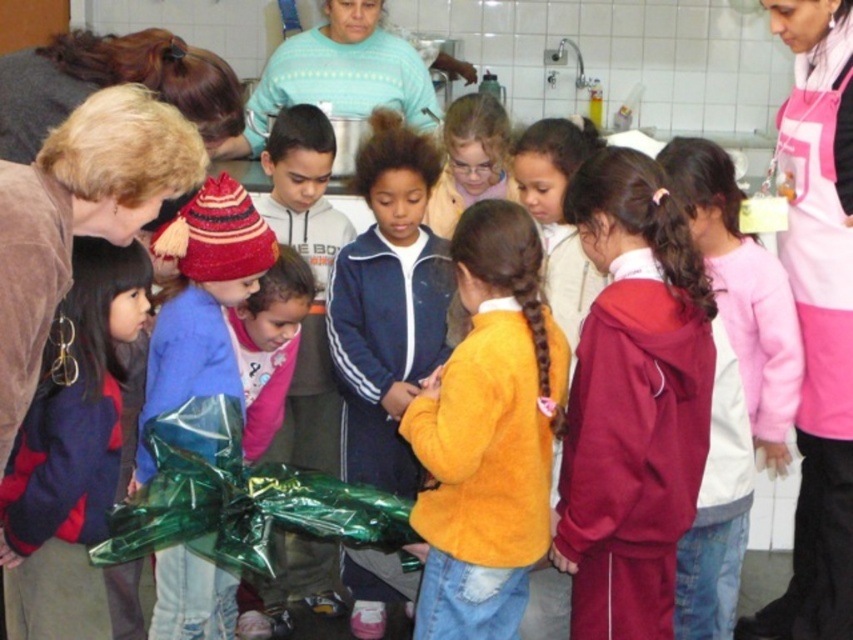
Question: Among these objects, which one is farthest from the camera?

Choices:
 (A) light blue sweater at center
 (B) velvet red jacket at left

Answer: (A)

Question: Can you confirm if maroon fleece jacket at center is bigger than pink fleece sweater at center?

Choices:
 (A) no
 (B) yes

Answer: (A)

Question: Estimate the real-world distances between objects in this image. Which object is farther from the pink apron at right?

Choices:
 (A) shiny green wrapping paper at center
 (B) velvet red jacket at left

Answer: (B)

Question: Does maroon fleece jacket at center appear on the right side of velvet red jacket at left?

Choices:
 (A) yes
 (B) no

Answer: (A)

Question: Which object is positioned closest to the shiny green wrapping paper at center?

Choices:
 (A) blue velour jacket at center
 (B) orange fuzzy sweater at center
 (C) pink apron at right

Answer: (A)

Question: Considering the relative positions of orange fuzzy sweater at center and light blue sweater at center in the image provided, where is orange fuzzy sweater at center located with respect to light blue sweater at center?

Choices:
 (A) above
 (B) below

Answer: (B)